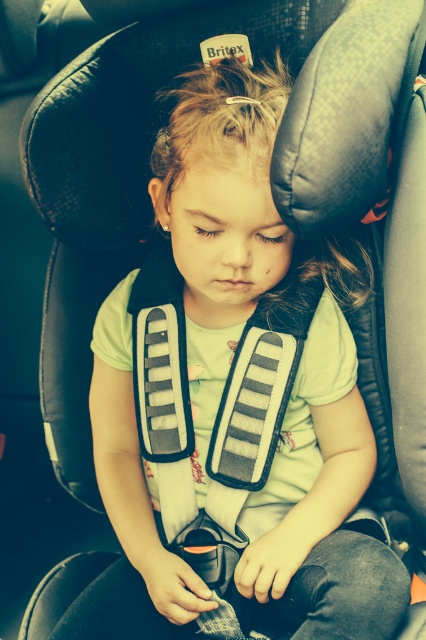
Question: Which point is farther from the camera taking this photo?

Choices:
 (A) (299, 451)
 (B) (213, 433)

Answer: (A)

Question: Which object appears farthest from the camera in this image?

Choices:
 (A) matte gray safety vest at center
 (B) green matte vest at center

Answer: (A)

Question: Can you confirm if green matte vest at center is positioned above matte gray safety vest at center?

Choices:
 (A) no
 (B) yes

Answer: (B)

Question: Is green matte vest at center thinner than matte gray safety vest at center?

Choices:
 (A) no
 (B) yes

Answer: (A)

Question: Which point is farther to the camera?

Choices:
 (A) matte gray safety vest at center
 (B) green matte vest at center

Answer: (A)

Question: Does green matte vest at center have a greater width compared to matte gray safety vest at center?

Choices:
 (A) yes
 (B) no

Answer: (A)